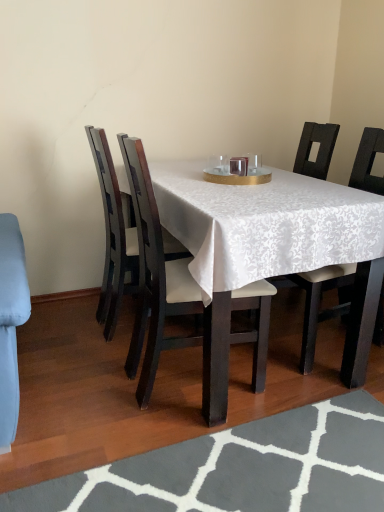
Identify the location of free spot in front of white fabric-covered chair at center, which is counted as the second chair, starting from the left. Image resolution: width=384 pixels, height=512 pixels. (177, 462).